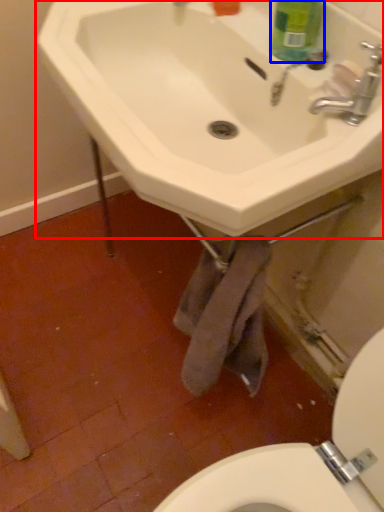
Question: Which object is closer to the camera taking this photo, sink (highlighted by a red box) or cleaning product (highlighted by a blue box)?

Choices:
 (A) sink
 (B) cleaning product

Answer: (A)